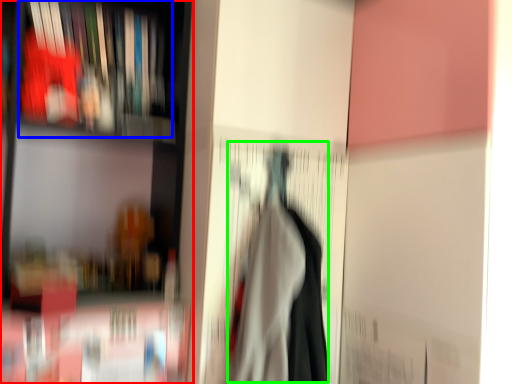
Question: Considering the real-world distances, which object is farthest from shelf (highlighted by a red box)? book (highlighted by a blue box) or woman (highlighted by a green box)?

Choices:
 (A) book
 (B) woman

Answer: (B)